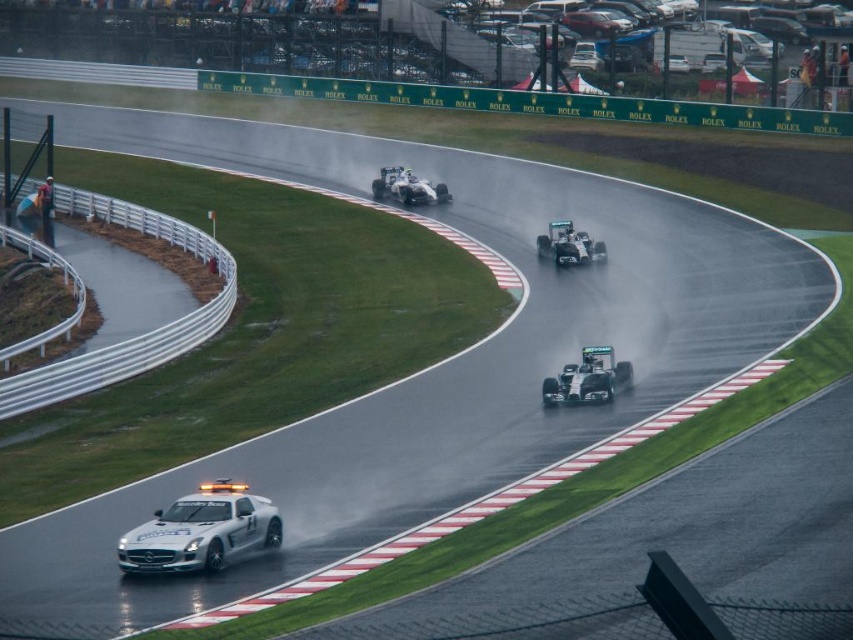
Question: Which of these objects is positioned farthest from the white glossy car at lower left?

Choices:
 (A) metallic silver race car at upper center
 (B) white matte race car at center
 (C) white metallic race car at center
 (D) silver metallic race car at center

Answer: (A)

Question: Does white glossy car at lower left appear under white metallic race car at center?

Choices:
 (A) no
 (B) yes

Answer: (B)

Question: Considering the real-world distances, which object is closest to the white matte race car at center?

Choices:
 (A) silver metallic race car at center
 (B) white glossy car at lower left

Answer: (A)

Question: Can you confirm if metallic silver race car at upper center is positioned above silver metallic race car at center?

Choices:
 (A) no
 (B) yes

Answer: (B)

Question: Does metallic silver race car at upper center appear under silver metallic race car at center?

Choices:
 (A) no
 (B) yes

Answer: (A)

Question: Which object is farther from the camera taking this photo?

Choices:
 (A) white matte race car at center
 (B) metallic silver race car at upper center
 (C) white metallic race car at center

Answer: (B)